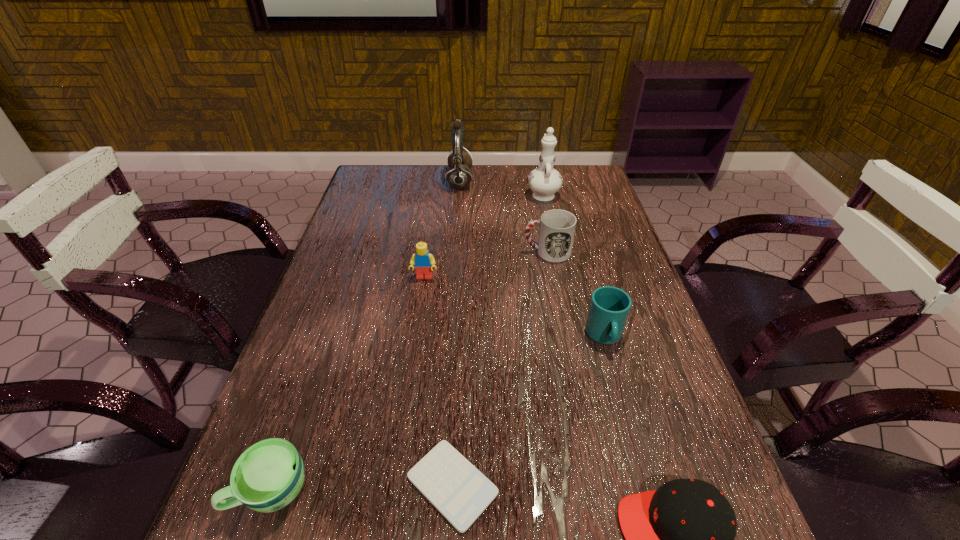
Find the location of `earphone`. earphone is located at coordinates (458, 175).

In order to click on chinaware in this screenshot , I will do `click(544, 181)`.

Image resolution: width=960 pixels, height=540 pixels. Identify the location of the farthest cup. (557, 227).

Locate an element on the screen. Image resolution: width=960 pixels, height=540 pixels. Lego is located at coordinates (423, 261).

The image size is (960, 540). What are the coordinates of `the fifth farthest object` in the screenshot? It's located at 609,308.

What are the coordinates of `the leftmost cup` in the screenshot? It's located at (267, 476).

At what (x,y) coordinates should I click in order to perform the action: click on the leftmost object. Please return your answer as a coordinate pair (x, y). This screenshot has height=540, width=960. Looking at the image, I should click on (267, 476).

I want to click on the shortest object, so click(x=460, y=492).

Locate an element on the screen. This screenshot has width=960, height=540. vacant area situated 0.390m on the ear pads of the earphone is located at coordinates (590, 181).

You are a GUI agent. You are given a task and a screenshot of the screen. Output one action in this format:
    pyautogui.click(x=<x>, y=<y>)
    Task: Click on the free point located at the spout of the chinaware
    
    Given the screenshot: What is the action you would take?
    pyautogui.click(x=538, y=168)